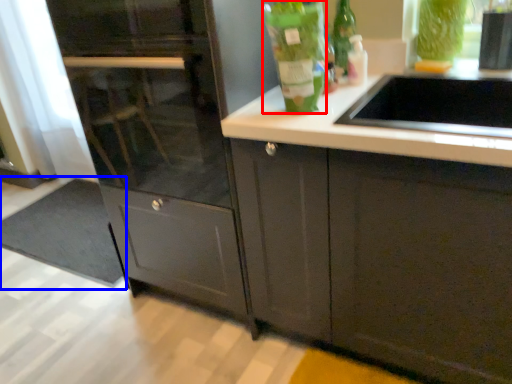
Question: Which of the following is the closest to the observer, bottle (highlighted by a red box) or doormat (highlighted by a blue box)?

Choices:
 (A) bottle
 (B) doormat

Answer: (A)